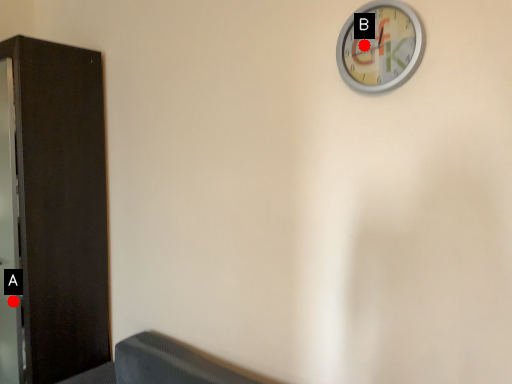
Question: Two points are circled on the image, labeled by A and B beside each circle. Which of the following is the closest to the observer?

Choices:
 (A) A is closer
 (B) B is closer

Answer: (B)